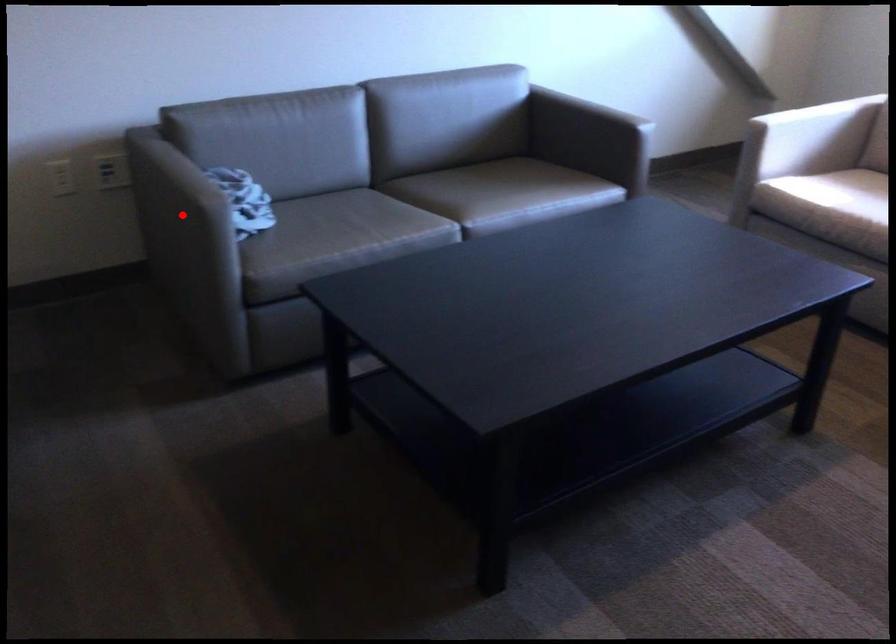
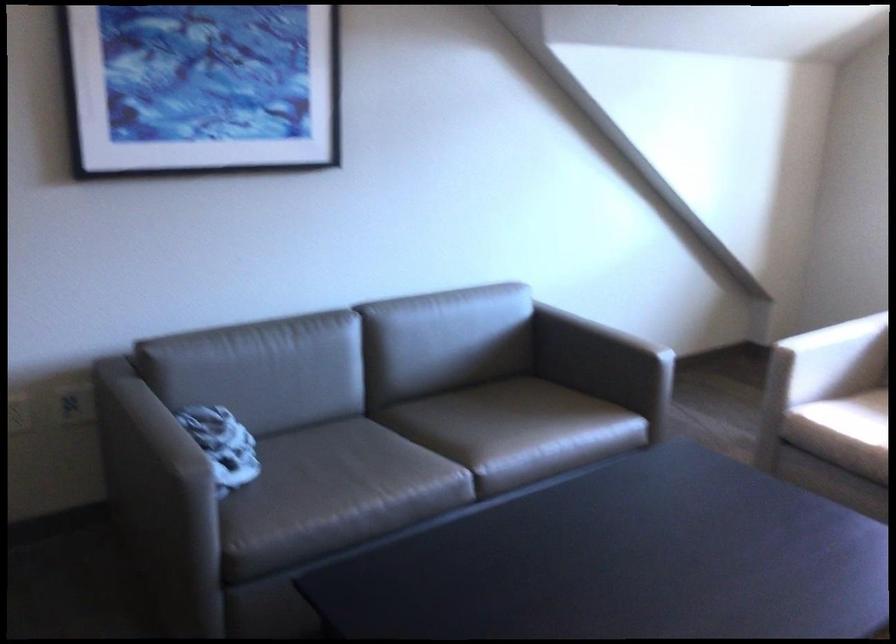
The point at the highlighted location is marked in the first image. Where is the corresponding point in the second image?

(158, 491)